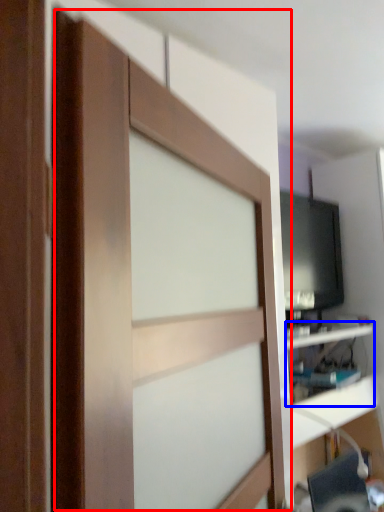
Question: Which object is further to the camera taking this photo, barn door (highlighted by a red box) or shelf (highlighted by a blue box)?

Choices:
 (A) barn door
 (B) shelf

Answer: (B)